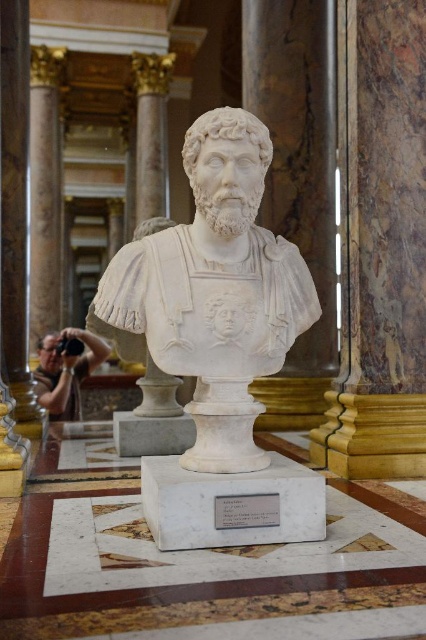
You are a museum curator who needs to install a new security sensor between the white marble bust at center and the marble column at center. The sensor requires a minimum of 1 meter of space to function properly. Can you place it between them?

The distance between the white marble bust at center and the marble column at center is 1.22 meters, which is more than the required 1 meter. Therefore, the sensor can be placed between them.

You are an art conservator standing in front of the marble bust. You notice a specific point marked at coordinates (215, 291). Where exactly is this point located on the bust?

The point marked at coordinates (215, 291) is located on the white marble bust at center.